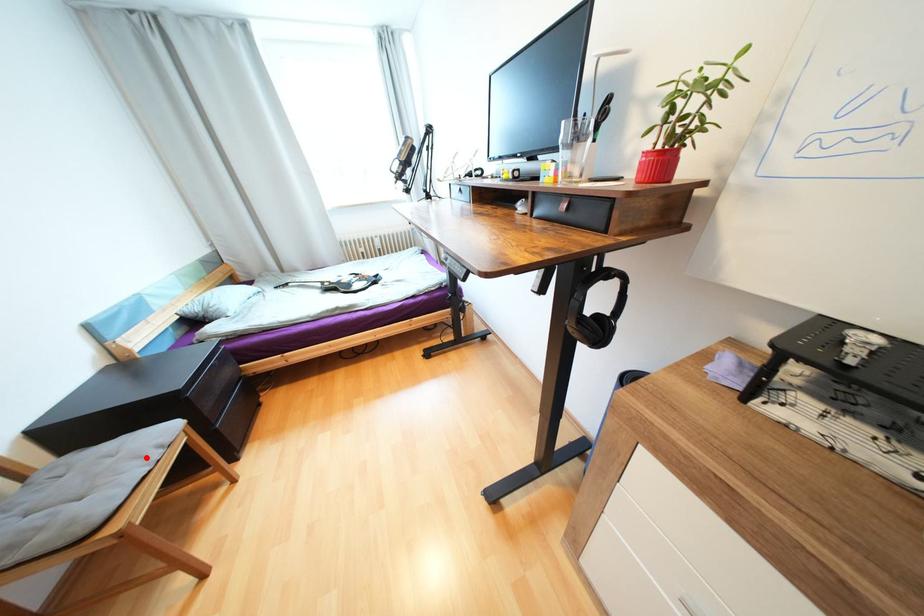
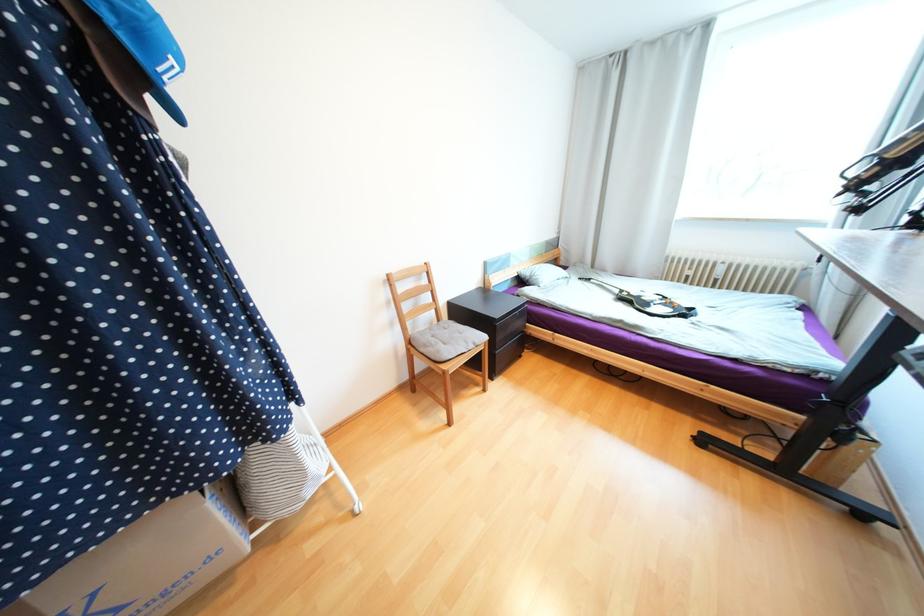
Question: A red point is marked in image1. In image2, is the corresponding 3D point closer to the camera or farther? Reply with the corresponding letter.

Choices:
 (A) The corresponding 3D point is closer.
 (B) The corresponding 3D point is farther.

Answer: (A)